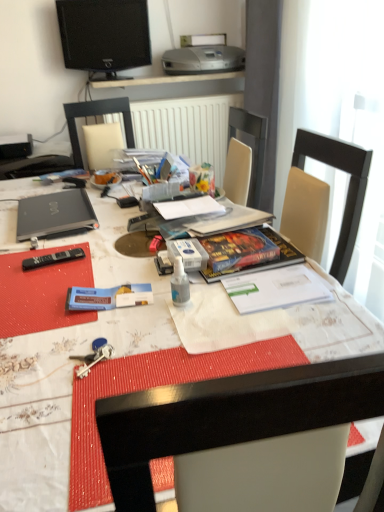
This screenshot has height=512, width=384. In order to click on free area in between black plastic remote control at lower left and white paper at center in this screenshot , I will do `click(114, 243)`.